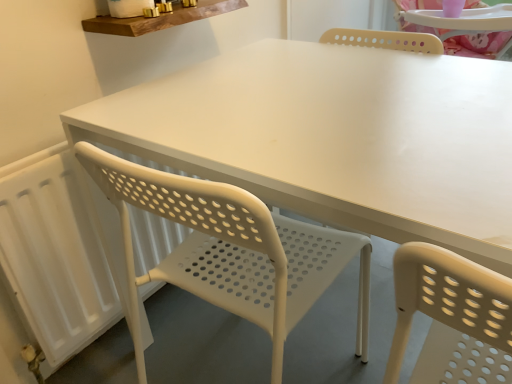
Question: Is wooden shelf at upper center positioned behind white perforated plastic chair at center?

Choices:
 (A) no
 (B) yes

Answer: (B)

Question: From the image's perspective, would you say wooden shelf at upper center is shown under white perforated plastic chair at center?

Choices:
 (A) yes
 (B) no

Answer: (B)

Question: Does wooden shelf at upper center appear on the right side of white perforated plastic chair at center?

Choices:
 (A) no
 (B) yes

Answer: (A)

Question: Is wooden shelf at upper center smaller than white perforated plastic chair at center?

Choices:
 (A) no
 (B) yes

Answer: (B)

Question: From a real-world perspective, is wooden shelf at upper center physically below white perforated plastic chair at center?

Choices:
 (A) no
 (B) yes

Answer: (A)

Question: Is white matte radiator at left in front of or behind wooden shelf at upper center in the image?

Choices:
 (A) behind
 (B) front

Answer: (B)

Question: From their relative heights in the image, would you say white matte radiator at left is taller or shorter than wooden shelf at upper center?

Choices:
 (A) short
 (B) tall

Answer: (B)

Question: From the image's perspective, is white matte radiator at left above or below wooden shelf at upper center?

Choices:
 (A) below
 (B) above

Answer: (A)

Question: Is point (74, 316) positioned closer to the camera than point (147, 21)?

Choices:
 (A) farther
 (B) closer

Answer: (A)

Question: In terms of width, does white matte radiator at left look wider or thinner when compared to white perforated plastic chair at center?

Choices:
 (A) thin
 (B) wide

Answer: (A)

Question: From a real-world perspective, is white matte radiator at left positioned above or below white perforated plastic chair at center?

Choices:
 (A) below
 (B) above

Answer: (A)

Question: Would you say white matte radiator at left is inside or outside white perforated plastic chair at center?

Choices:
 (A) inside
 (B) outside

Answer: (B)

Question: From the image's perspective, is white matte radiator at left positioned above or below white perforated plastic chair at center?

Choices:
 (A) below
 (B) above

Answer: (B)

Question: Is wooden shelf at upper center inside the boundaries of white perforated plastic chair at center, or outside?

Choices:
 (A) outside
 (B) inside

Answer: (A)

Question: From a real-world perspective, is wooden shelf at upper center physically located above or below white perforated plastic chair at center?

Choices:
 (A) above
 (B) below

Answer: (A)